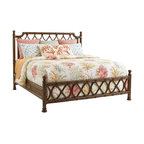
This screenshot has width=144, height=144. What are the coordinates of `solid pink pillow` in the screenshot? It's located at (29, 42), (69, 42).